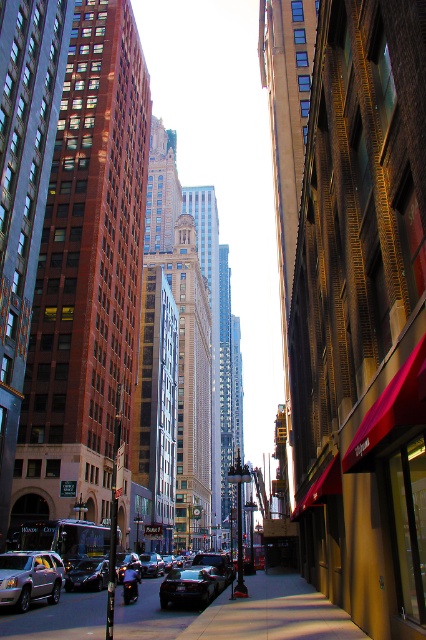
You are a delivery person needing to park your 2.5 meters wide van in this street. There is a metallic silver sedan at lower left and a shiny black sedan at center parked nearby. Which parking spot between these two cars would be suitable for your van?

The metallic silver sedan at lower left has a greater width than the shiny black sedan at center. Since your van is 2.5 meters wide, you should choose the parking spot between the metallic silver sedan at lower left and the shiny black sedan at center, as the space between them is likely wider than 2.5 meters.

From the picture: You are a delivery person who needs to park your 2.5 meters wide truck in this street. You see the metallic silver sedan at lower left and the shiny black car at center. Which car takes up more space on the road?

The metallic silver sedan at lower left is wider than the shiny black car at center, so it takes up more space on the road.

You are a pedestrian standing on the sidewalk and see both the metallic silver sedan at lower left and the shiny black sedan at center. Which car is positioned to the right of the other?

The metallic silver sedan at lower left is to the right of the shiny black sedan at center.